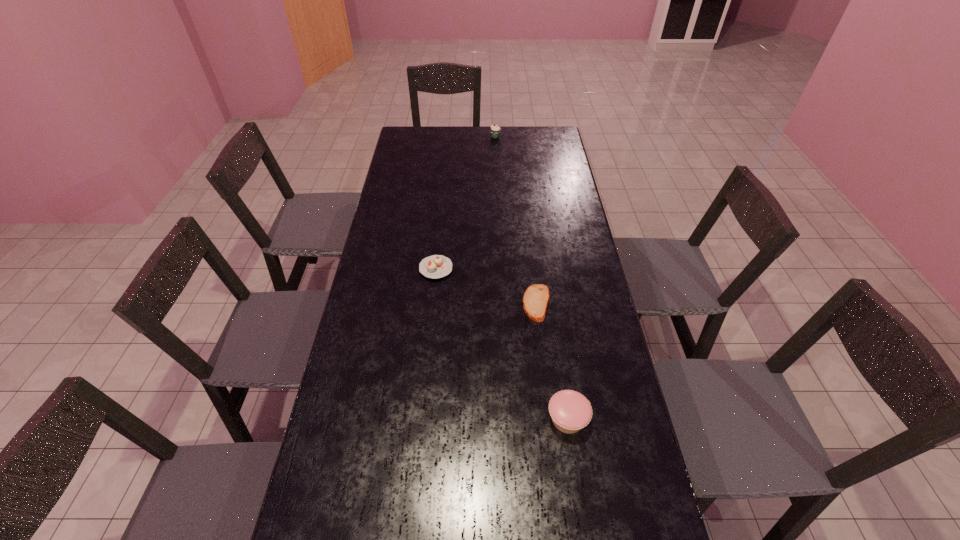
Identify the location of blank space located on the back of the third tallest object. Image resolution: width=960 pixels, height=540 pixels. (444, 192).

Locate an element on the screen. free space located 0.330m on the front of the pita bread is located at coordinates (551, 429).

You are a GUI agent. You are given a task and a screenshot of the screen. Output one action in this format:
    pyautogui.click(x=<x>, y=<y>)
    Task: Click on the object located in the far edge section of the desktop
    The image size is (960, 540).
    Given the screenshot: What is the action you would take?
    pyautogui.click(x=495, y=130)

You are a GUI agent. You are given a task and a screenshot of the screen. Output one action in this format:
    pyautogui.click(x=<x>, y=<y>)
    Task: Click on the cupcake present at the right edge
    This screenshot has height=540, width=960.
    Given the screenshot: What is the action you would take?
    pyautogui.click(x=570, y=411)

This screenshot has height=540, width=960. I want to click on pita bread located in the right edge section of the desktop, so click(x=536, y=297).

Image resolution: width=960 pixels, height=540 pixels. In the image, there is a desktop. In order to click on free region at the far edge in this screenshot , I will do `click(472, 148)`.

In the image, there is a desktop. At what (x,y) coordinates should I click in order to perform the action: click on vacant space at the left edge. Please return your answer as a coordinate pair (x, y). Looking at the image, I should click on (399, 165).

You are a GUI agent. You are given a task and a screenshot of the screen. Output one action in this format:
    pyautogui.click(x=<x>, y=<y>)
    Task: Click on the free region at the right edge of the desktop
    
    Given the screenshot: What is the action you would take?
    pyautogui.click(x=535, y=160)

You are a GUI agent. You are given a task and a screenshot of the screen. Output one action in this format:
    pyautogui.click(x=<x>, y=<y>)
    Task: Click on the free space at the far left corner of the desktop
    The image size is (960, 540).
    Given the screenshot: What is the action you would take?
    pyautogui.click(x=423, y=134)

I want to click on vacant space at the far right corner of the desktop, so click(x=552, y=131).